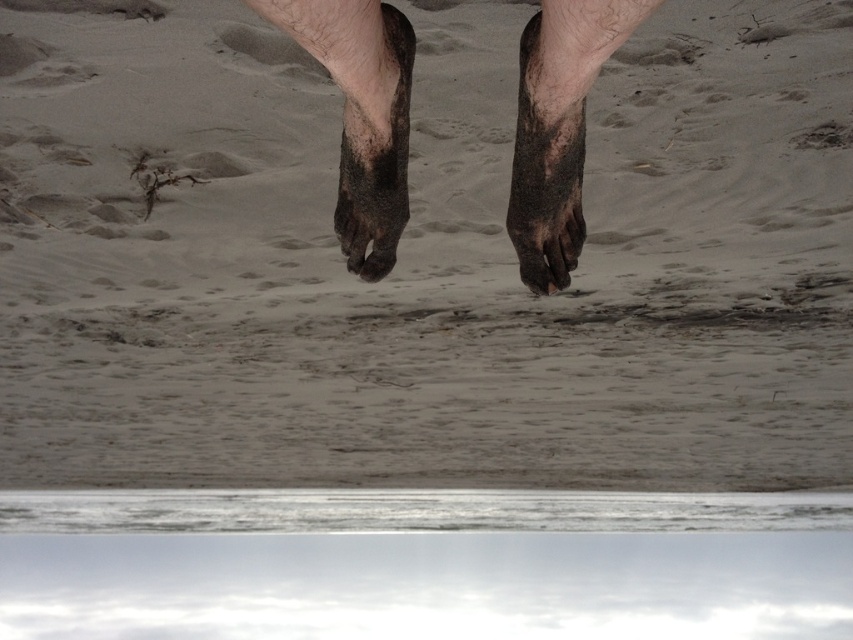
Question: From the image, what is the correct spatial relationship of dull brown skin at center in relation to dirty sand foot at center?

Choices:
 (A) below
 (B) above

Answer: (B)

Question: Does dull black feet at center appear over dusty brown foot at center?

Choices:
 (A) no
 (B) yes

Answer: (B)

Question: Which point is closer to the camera?

Choices:
 (A) dull black feet at center
 (B) dusty brown foot at center
 (C) dull brown skin at center

Answer: (A)

Question: Which object is positioned farthest from the dull brown skin at center?

Choices:
 (A) dusty brown foot at center
 (B) dull black feet at center
 (C) dirty sand foot at center

Answer: (C)

Question: Is dull black feet at center above dirty sand foot at center?

Choices:
 (A) yes
 (B) no

Answer: (A)

Question: Among these objects, which one is nearest to the camera?

Choices:
 (A) dull brown skin at center
 (B) dusty brown foot at center

Answer: (A)